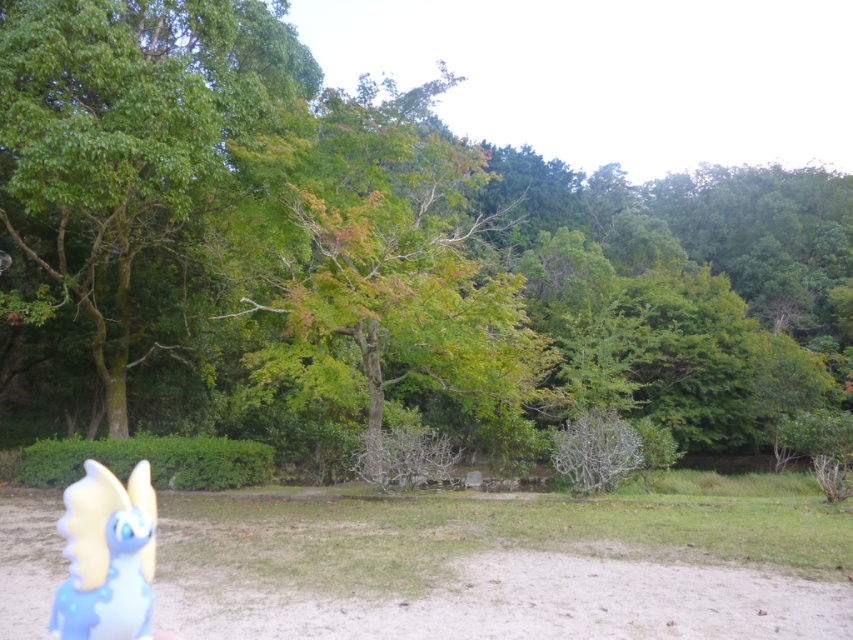
You are standing at the bottom left corner of the image where the cartoonish creature is located. You want to walk to the brown sandy dirt at center. Which direction should you move in?

You should move towards the center of the image to reach the brown sandy dirt at center, as it is located at point coordinates approximately 0.883 on the x and 0.587 on the y axis.

You are planning to set up a picnic blanket in the park. The picnic blanket is 2 meters wide. You see the brown sandy dirt at center and the green leafy tree at left. Which area can accommodate the picnic blanket based on their widths?

The brown sandy dirt at center has a larger width than the green leafy tree at left, so the picnic blanket can fit on the brown sandy dirt at center.